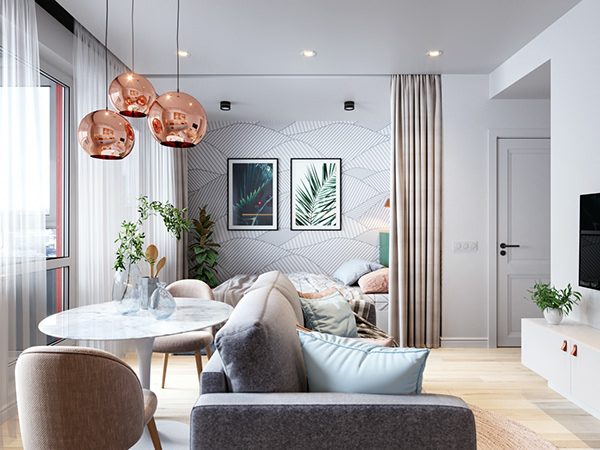
In order to click on white marble pedestal dining room table in this screenshot , I will do `click(146, 334)`.